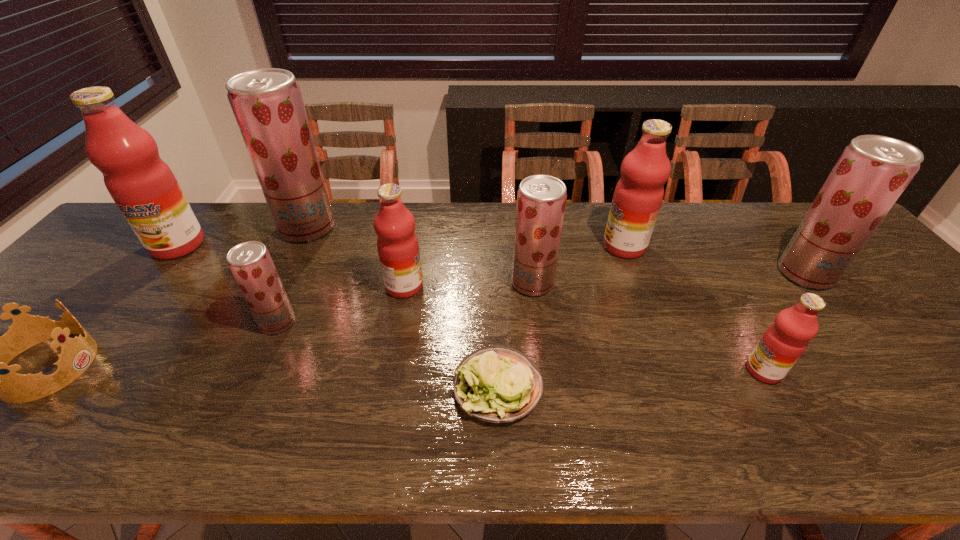
You are a GUI agent. You are given a task and a screenshot of the screen. Output one action in this format:
    pyautogui.click(x=<x>, y=<y>)
    Task: Click on the second nearest pink fruit juice
    The image size is (960, 540).
    Given the screenshot: What is the action you would take?
    pyautogui.click(x=397, y=244)

Identify the location of the second nearest fruit juice. This screenshot has height=540, width=960. (250, 263).

In order to click on the smallest strawberry fruit juice in this screenshot , I will do `click(250, 263)`.

Find the location of a particular element. The width and height of the screenshot is (960, 540). the rightmost pink fruit juice is located at coordinates (783, 343).

Find the location of `the second fruit juice from right to left`. the second fruit juice from right to left is located at coordinates (783, 343).

Where is `the shortest object`? This screenshot has width=960, height=540. the shortest object is located at coordinates (497, 384).

What are the coordinates of `lettuce` in the screenshot? It's located at (497, 384).

The width and height of the screenshot is (960, 540). I want to click on vacant space situated on the front of the farthest strawberry fruit juice, so click(x=248, y=354).

This screenshot has width=960, height=540. Find the location of `vacant space located 0.100m on the label of the leftmost fruit juice`. vacant space located 0.100m on the label of the leftmost fruit juice is located at coordinates (145, 286).

You are a GUI agent. You are given a task and a screenshot of the screen. Output one action in this format:
    pyautogui.click(x=<x>, y=<y>)
    Task: Click on the free space located on the back of the rightmost fruit juice
    Image resolution: width=960 pixels, height=540 pixels.
    Given the screenshot: What is the action you would take?
    pyautogui.click(x=756, y=213)